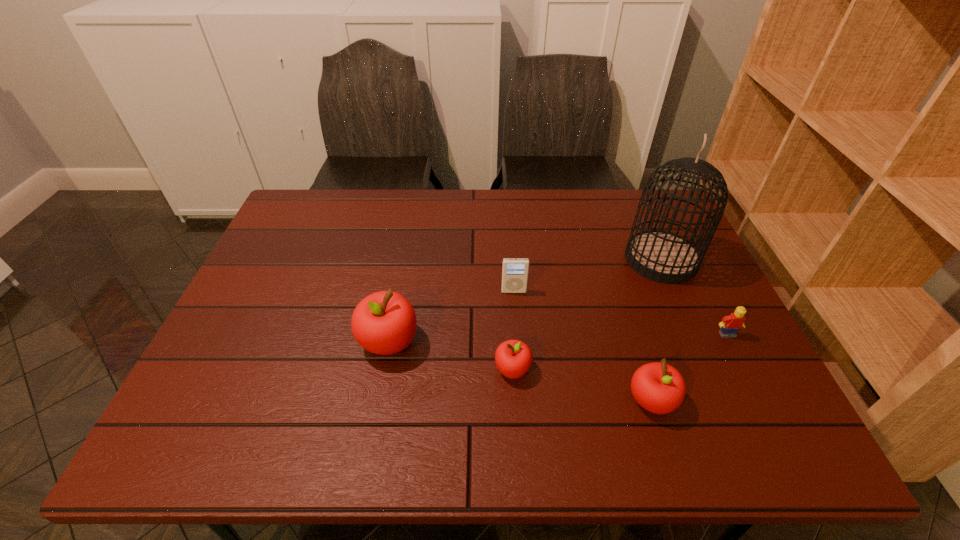
Given the evenly spaced apples in the image, where should an extra apple be added on the left to preserve the spacing? Please point to a vacant space. Please provide its 2D coordinates. Your answer should be formatted as a tuple, i.e. [(x, y)], where the tuple contains the x and y coordinates of a point satisfying the conditions above.

[(278, 316)]